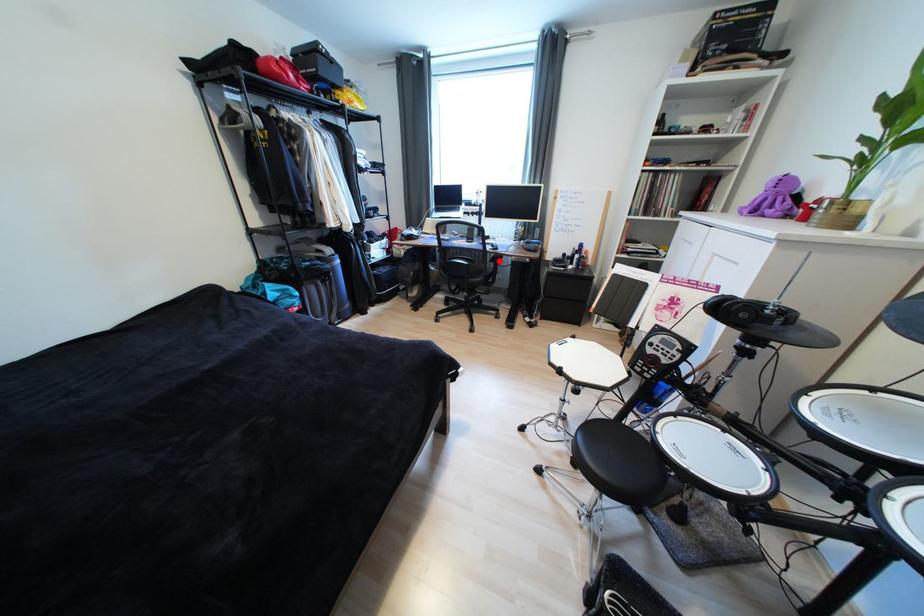
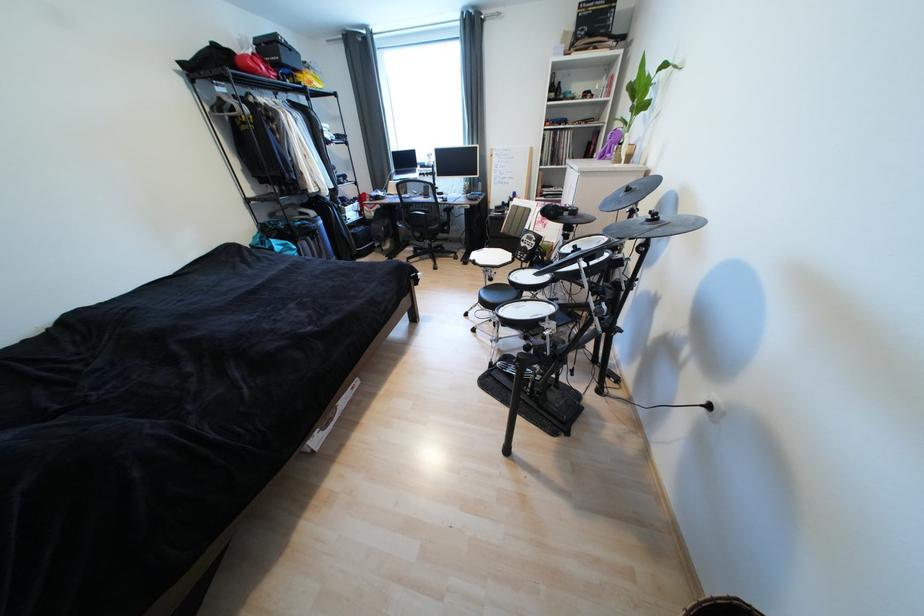
The point at the highlighted location is marked in the first image. Where is the corresponding point in the second image?

(452, 212)